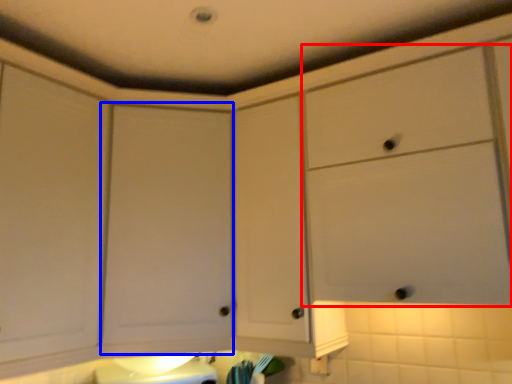
Question: Which point is further to the camera, cabinetry (highlighted by a red box) or cabinetry (highlighted by a blue box)?

Choices:
 (A) cabinetry
 (B) cabinetry

Answer: (B)